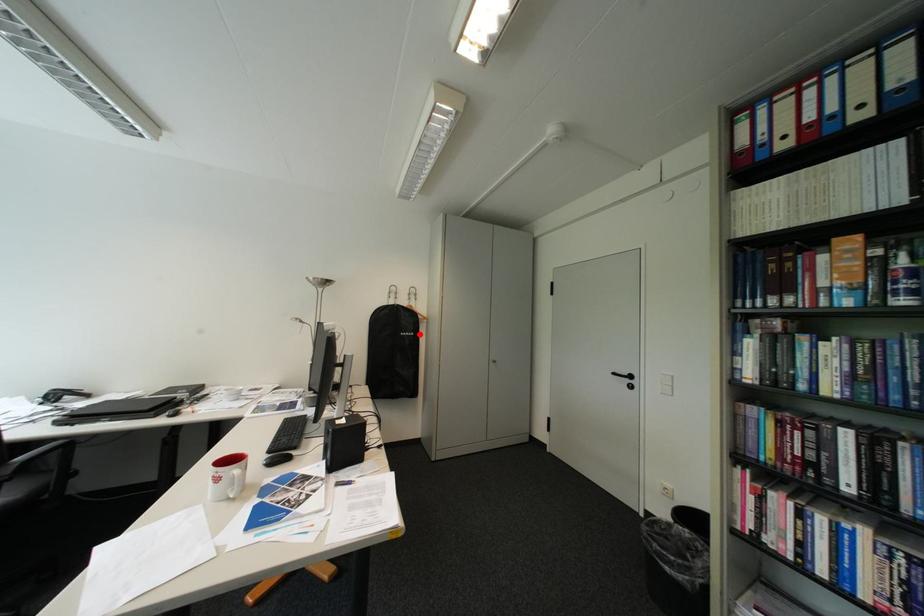
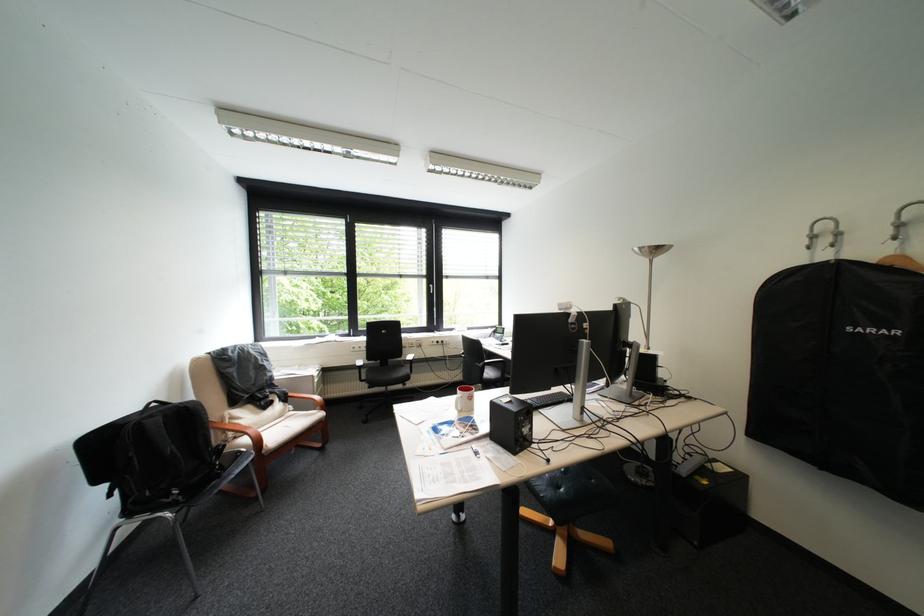
Question: I am providing you with two images of the same scene from different viewpoints. Image1 has a red point marked. In image2, the corresponding 3D location appears at what relative position? Reply with the corresponding letter.

Choices:
 (A) Closer
 (B) Farther

Answer: (A)